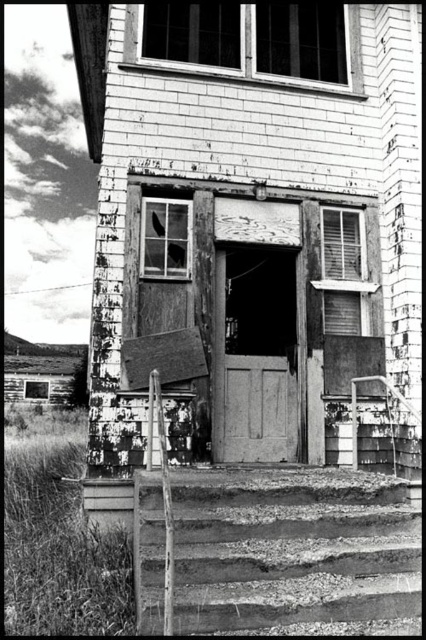
You are standing at point (294, 552) in the image of the old house. What object is located exactly at your current position?

Rusty metal stairs at center are located exactly at point (294, 552).

You are standing in front of the old house and want to enter through the smooth wooden door at center. To reach the door, you must first navigate around the rusty metal stairs at center. Which direction should you move to go around the stairs and approach the door?

Since the rusty metal stairs at center are in front of the smooth wooden door at center, you should move to either the left or right side of the stairs to approach the door.

You are a delivery person trying to deliver a package to the house. The package is too large to fit through the smooth wooden door at center. Can you use the rusty metal stairs at center to reach the second floor instead?

The rusty metal stairs at center are wider than the smooth wooden door at center, so they might provide enough space for the package. However, since the stairs are rusty and the house appears dilapidated, their structural integrity is questionable. It is not advisable to use the rusty metal stairs at center for safety reasons.